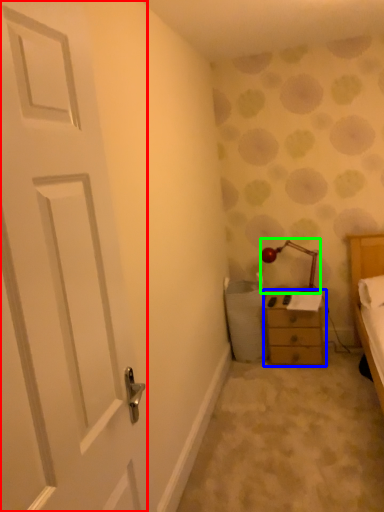
Question: Based on their relative distances, which object is farther from door (highlighted by a red box)? Choose from chest of drawers (highlighted by a blue box) and lamp (highlighted by a green box).

Choices:
 (A) chest of drawers
 (B) lamp

Answer: (B)